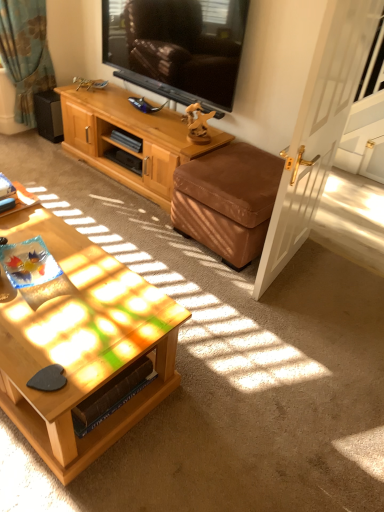
Identify the location of free space in front of white glossy door at right. The height and width of the screenshot is (512, 384). (297, 314).